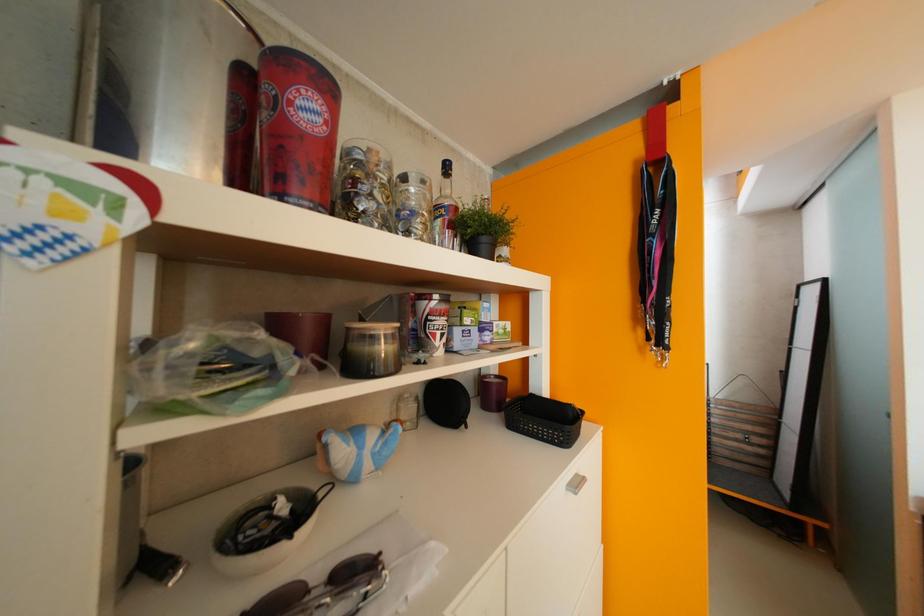
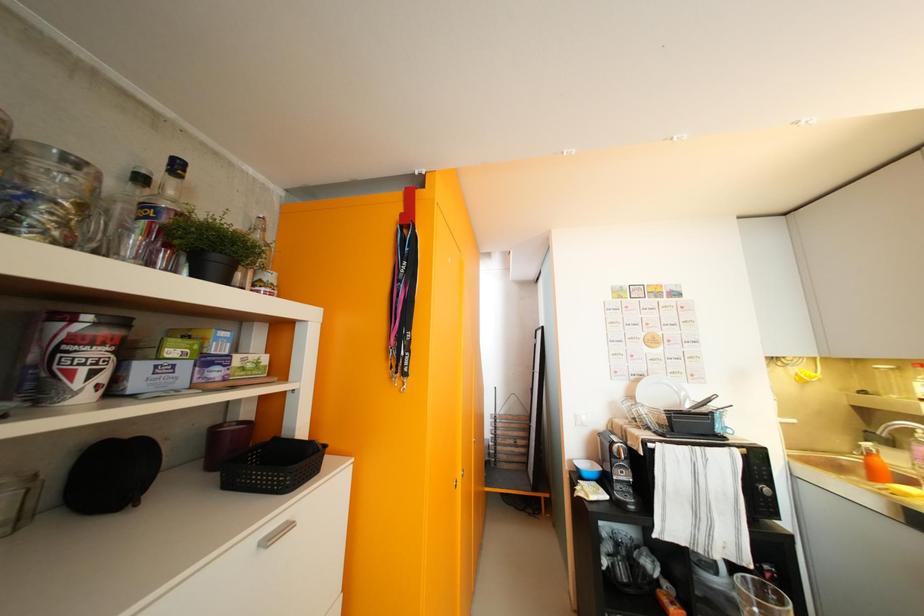
Question: The camera is either moving clockwise (left) or counter-clockwise (right) around the object. The first image is from the beginning of the video and the second image is from the end. Is the camera moving left or right when shooting the video?

Choices:
 (A) Left
 (B) Right

Answer: (A)